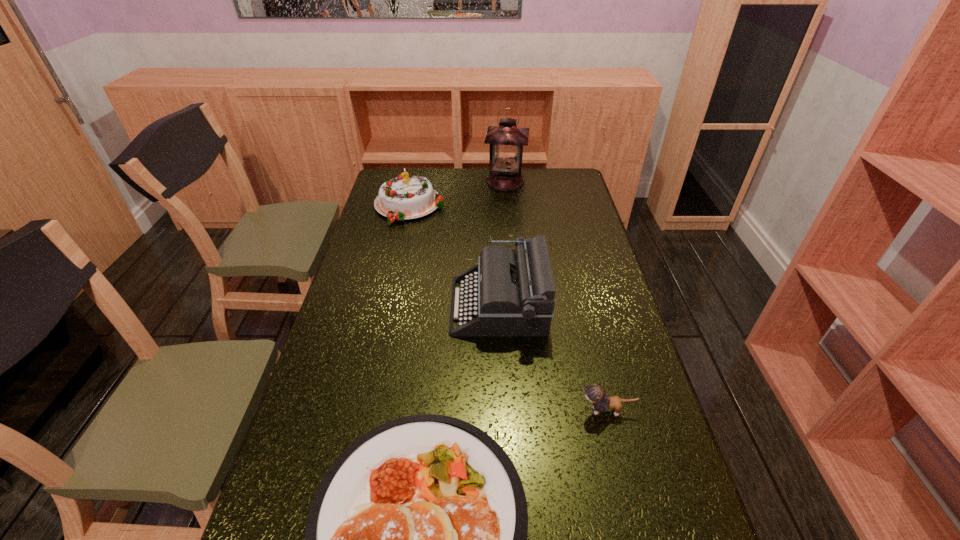
Locate an element on the screen. vacant region at the far right corner of the desktop is located at coordinates (547, 173).

Where is `free spot between the typewriter and the tallest object`? Image resolution: width=960 pixels, height=540 pixels. free spot between the typewriter and the tallest object is located at coordinates (502, 244).

Locate an element on the screen. This screenshot has height=540, width=960. vacant space that's between the rightmost object and the oil lamp is located at coordinates (556, 296).

At what (x,y) coordinates should I click in order to perform the action: click on vacant space in between the fourth tallest object and the typewriter. Please return your answer as a coordinate pair (x, y). The height and width of the screenshot is (540, 960). Looking at the image, I should click on (553, 358).

What are the coordinates of `free space between the typewriter and the oil lamp` in the screenshot? It's located at (502, 244).

Image resolution: width=960 pixels, height=540 pixels. I want to click on free space between the third tallest object and the typewriter, so click(x=454, y=256).

Point out which object is positioned as the second nearest to the third shortest object. Please provide its 2D coordinates. Your answer should be formatted as a tuple, i.e. [(x, y)], where the tuple contains the x and y coordinates of a point satisfying the conditions above.

[(514, 292)]

Image resolution: width=960 pixels, height=540 pixels. I want to click on the second closest object to the third nearest object, so click(x=416, y=539).

Locate an element on the screen. This screenshot has width=960, height=540. free space that satisfies the following two spatial constraints: 1. on the back side of the cake; 2. on the left side of the oil lamp is located at coordinates (415, 181).